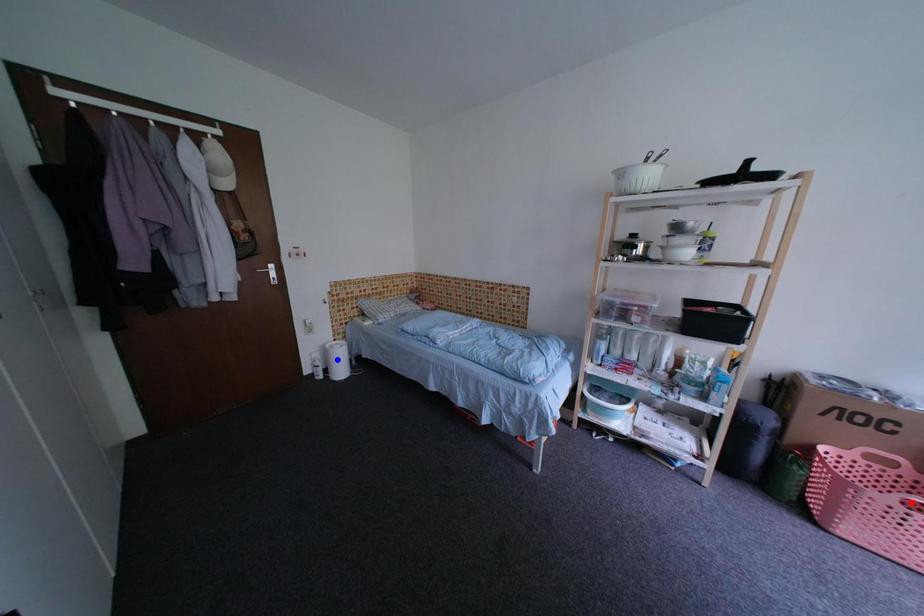
Question: Two points are marked on the image. Which point is closer to the camera?

Choices:
 (A) Blue point is closer.
 (B) Red point is closer.

Answer: (B)